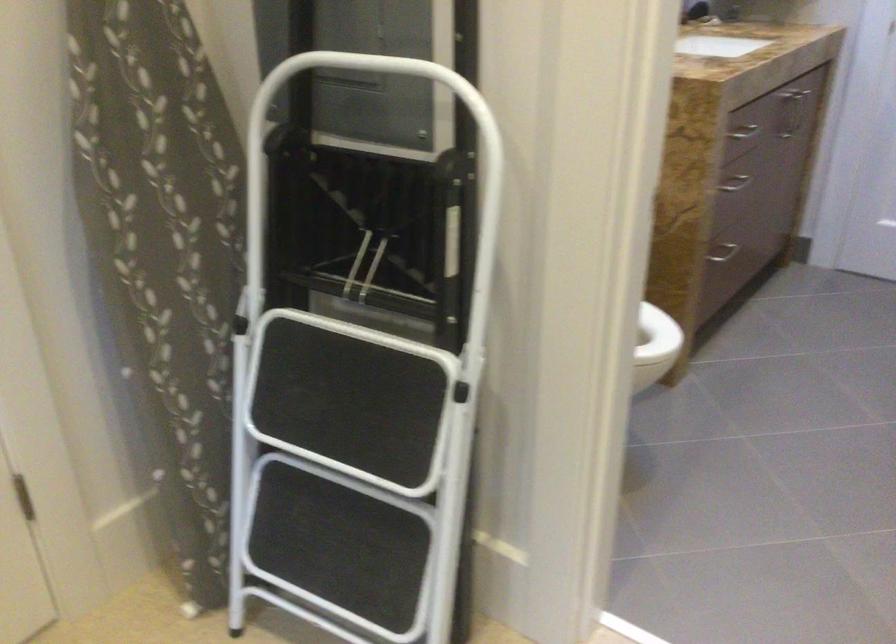
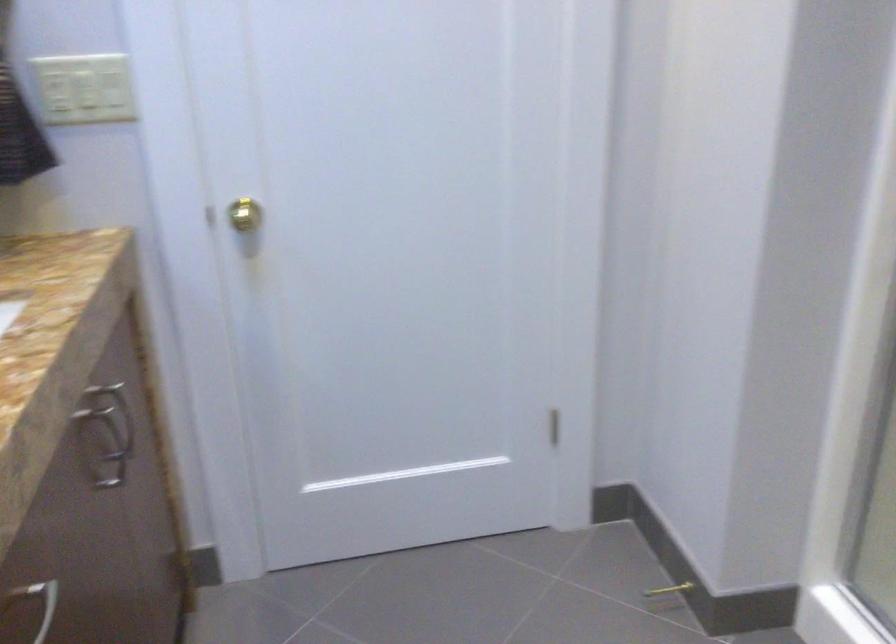
Locate, in the second image, the point that corresponds to [739,136] in the first image.

(37, 603)